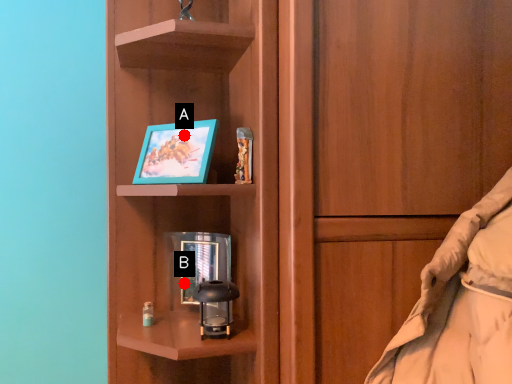
Question: Two points are circled on the image, labeled by A and B beside each circle. Which of the following is the closest to the observer?

Choices:
 (A) A is closer
 (B) B is closer

Answer: (A)